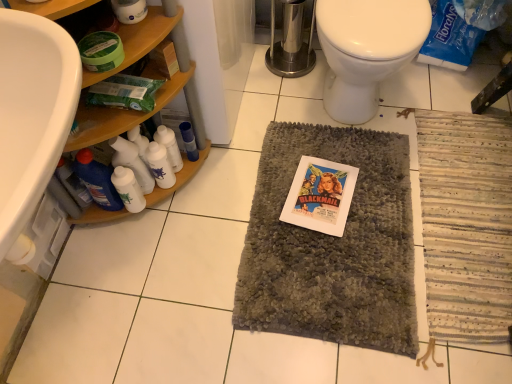
Question: From a real-world perspective, is white glossy bottle at lower left, the 4th bottle viewed from the right, on top of matte paper comic book at center?

Choices:
 (A) no
 (B) yes

Answer: (B)

Question: From a real-world perspective, is white glossy bottle at lower left, the 4th bottle viewed from the right, below matte paper comic book at center?

Choices:
 (A) no
 (B) yes

Answer: (A)

Question: Can you confirm if white glossy bottle at lower left, the 4th bottle viewed from the right, is positioned to the left of matte paper comic book at center?

Choices:
 (A) no
 (B) yes

Answer: (B)

Question: Can you confirm if white glossy bottle at lower left, the second bottle in the left-to-right sequence, is positioned to the right of matte paper comic book at center?

Choices:
 (A) yes
 (B) no

Answer: (B)

Question: Is white glossy bottle at lower left, the second bottle in the left-to-right sequence, aimed at matte paper comic book at center?

Choices:
 (A) yes
 (B) no

Answer: (B)

Question: Does white glossy bottle at lower left, the second bottle in the left-to-right sequence, have a greater width compared to matte paper comic book at center?

Choices:
 (A) no
 (B) yes

Answer: (A)

Question: From a real-world perspective, is white glossy bottle at lower left, the second bottle in the left-to-right sequence, located higher than white plastic bottles at left, which is the 2th bottle in right-to-left order?

Choices:
 (A) yes
 (B) no

Answer: (A)

Question: Is white glossy bottle at lower left, the 4th bottle viewed from the right, positioned in front of white plastic bottles at left, placed as the fourth bottle when sorted from left to right?

Choices:
 (A) yes
 (B) no

Answer: (A)

Question: Is white glossy bottle at lower left, the second bottle in the left-to-right sequence, beside white plastic bottles at left, which is the 2th bottle in right-to-left order?

Choices:
 (A) yes
 (B) no

Answer: (B)

Question: Is white glossy bottle at lower left, the 4th bottle viewed from the right, smaller than white plastic bottles at left, placed as the fourth bottle when sorted from left to right?

Choices:
 (A) no
 (B) yes

Answer: (A)

Question: From the image's perspective, is white glossy bottle at lower left, the second bottle in the left-to-right sequence, under white plastic bottles at left, which is the 2th bottle in right-to-left order?

Choices:
 (A) no
 (B) yes

Answer: (B)

Question: Is white glossy bottle at lower left, the second bottle in the left-to-right sequence, aimed at white plastic bottles at left, which is the 2th bottle in right-to-left order?

Choices:
 (A) yes
 (B) no

Answer: (B)

Question: Considering the relative sizes of woodenshelves at left and gray shaggy mat at center in the image provided, is woodenshelves at left smaller than gray shaggy mat at center?

Choices:
 (A) yes
 (B) no

Answer: (B)